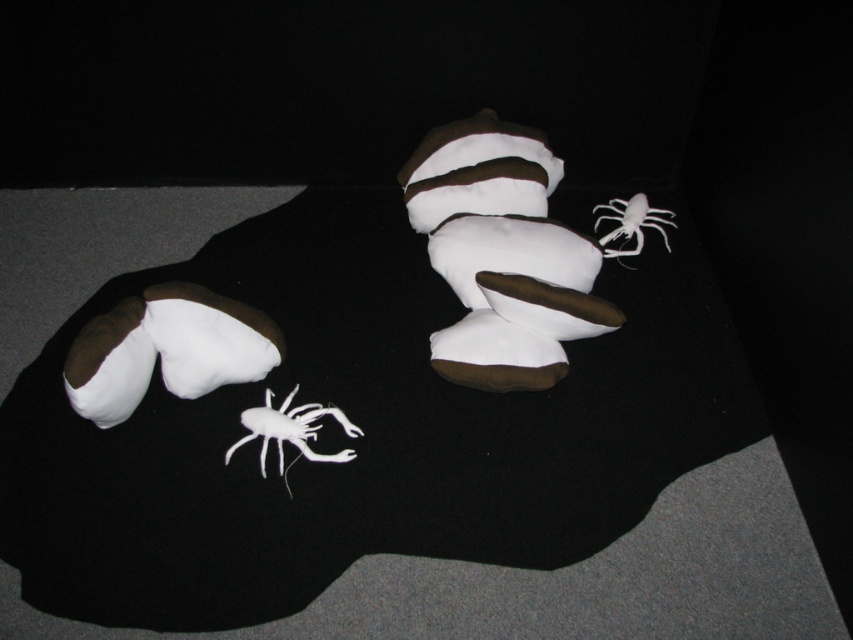
Between white matte spider at lower center and white matte spider at upper right, which one appears on the left side from the viewer's perspective?

white matte spider at lower center

How much distance is there between white matte spider at lower center and white matte spider at upper right?

white matte spider at lower center is 29.05 inches from white matte spider at upper right.

You are a GUI agent. You are given a task and a screenshot of the screen. Output one action in this format:
    pyautogui.click(x=<x>, y=<y>)
    Task: Click on the white matte spider at lower center
    
    Given the screenshot: What is the action you would take?
    pyautogui.click(x=291, y=432)

The image size is (853, 640). Find the location of `white matte spider at lower center`. white matte spider at lower center is located at coordinates (291, 432).